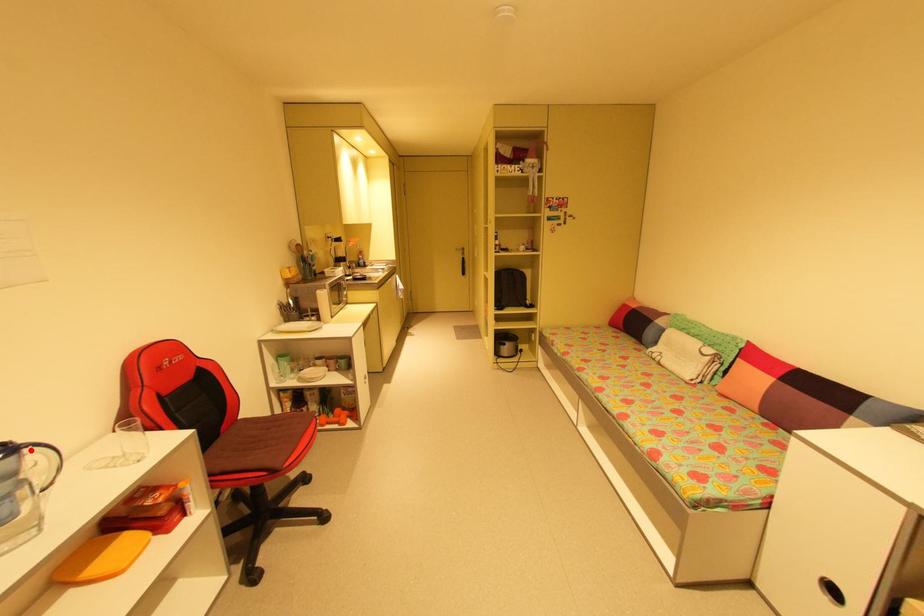
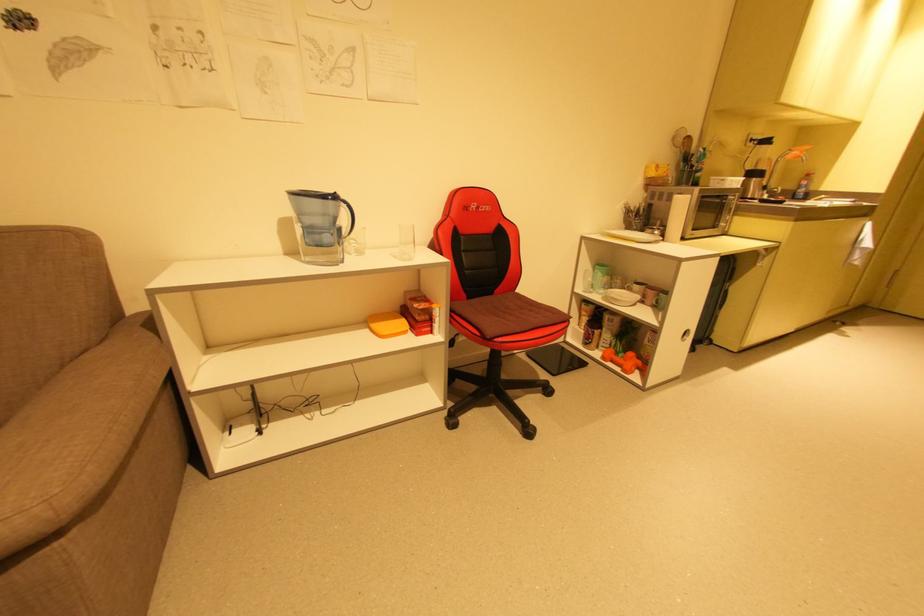
Find the pixel in the second image that matches the highlighted location in the first image.

(346, 204)